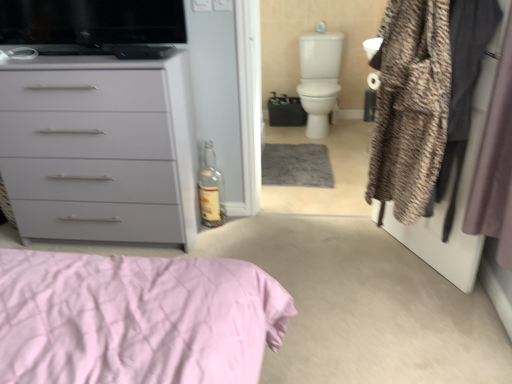
Find the location of a particular element. This screenshot has width=512, height=384. vacant space underneath silky purple curtain at right (from a real-world perspective) is located at coordinates (477, 316).